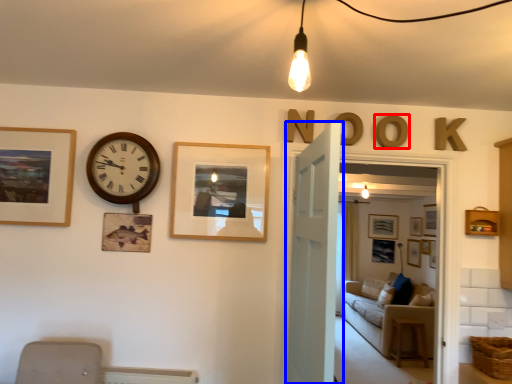
Question: Which point is closer to the camera, letter (highlighted by a red box) or door (highlighted by a blue box)?

Choices:
 (A) letter
 (B) door

Answer: (B)